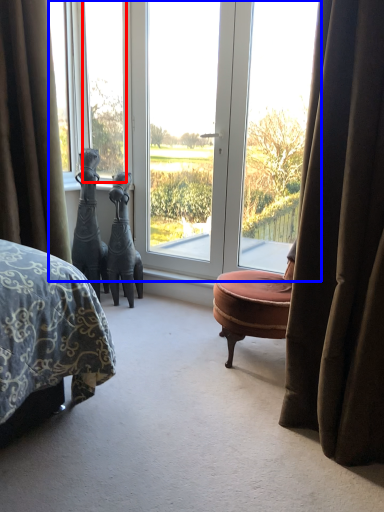
Question: Which object appears closest to the camera in this image, window (highlighted by a red box) or window (highlighted by a blue box)?

Choices:
 (A) window
 (B) window

Answer: (B)